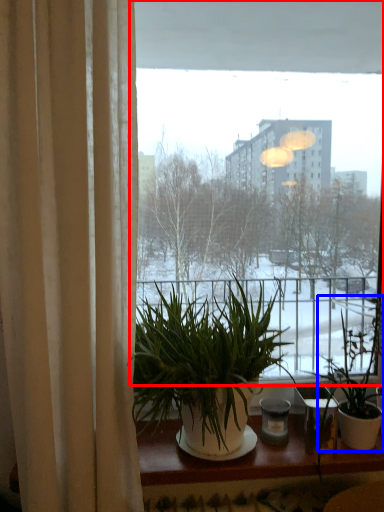
Question: Which point is further to the camera, window (highlighted by a red box) or houseplant (highlighted by a blue box)?

Choices:
 (A) window
 (B) houseplant

Answer: (A)